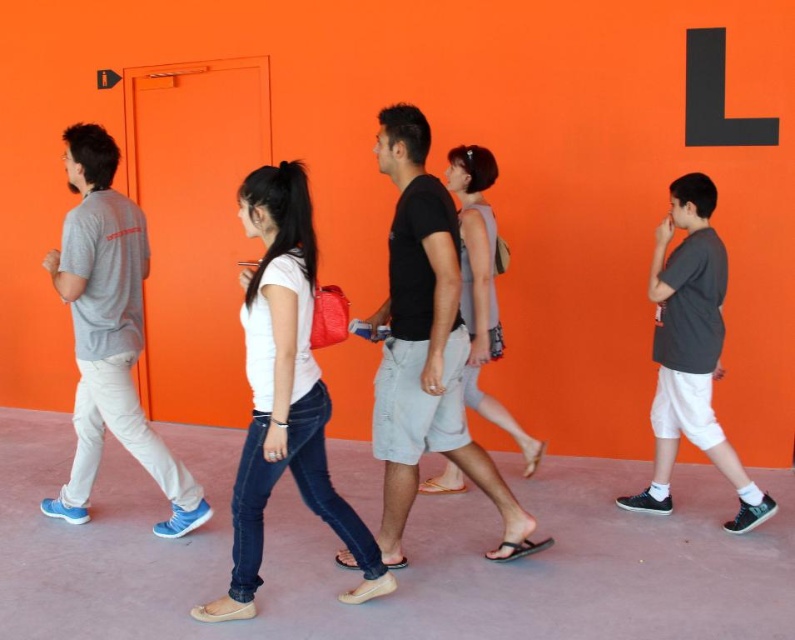
Is point (390, 432) closer to camera compared to point (76, 396)?

Yes, point (390, 432) is closer to viewer.

Who is more distant from viewer, (446, 326) or (80, 150)?

Positioned behind is point (80, 150).

Who is more distant from viewer, (x=375, y=449) or (x=103, y=339)?

The point (x=103, y=339) is more distant.

You are a GUI agent. You are given a task and a screenshot of the screen. Output one action in this format:
    pyautogui.click(x=<x>, y=<y>)
    Task: Click on the black cotton shirt at center
    
    Given the screenshot: What is the action you would take?
    pyautogui.click(x=425, y=346)

Does black cotton shirt at center have a smaller size compared to white matte shirt at center?

Actually, black cotton shirt at center might be larger than white matte shirt at center.

Is point (417, 364) farther from viewer compared to point (305, 304)?

That is True.

Measure the distance between black cotton shirt at center and camera.

A distance of 2.75 meters exists between black cotton shirt at center and camera.

The width and height of the screenshot is (795, 640). What are the coordinates of `black cotton shirt at center` in the screenshot? It's located at (425, 346).

Who is lower down, white matte shirt at center or gray cotton t-shirt at left?

Positioned lower is white matte shirt at center.

Between white matte shirt at center and gray cotton t-shirt at left, which one appears on the right side from the viewer's perspective?

Positioned to the right is white matte shirt at center.

Is point (250, 372) positioned before point (142, 269)?

Yes, it is in front of point (142, 269).

I want to click on white matte shirt at center, so click(284, 394).